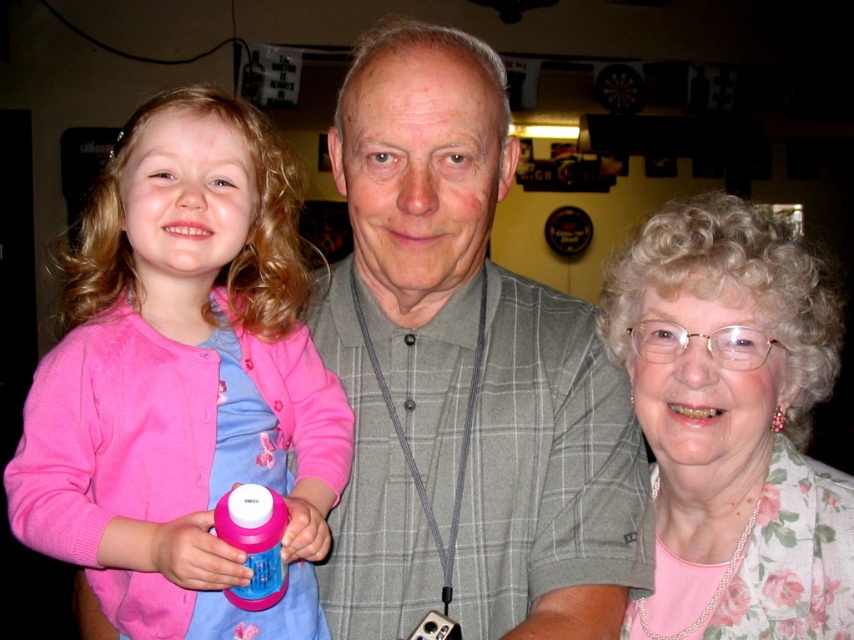
You are a photographer trying to capture a group photo of the gray plaid shirt at center and the pink fleece sweater at left. Which subject should you adjust to ensure both are centered in the frame?

The gray plaid shirt at center is positioned on the right side of pink fleece sweater at left, so you should move the gray plaid shirt at center to the left to align both subjects in the center of the frame.